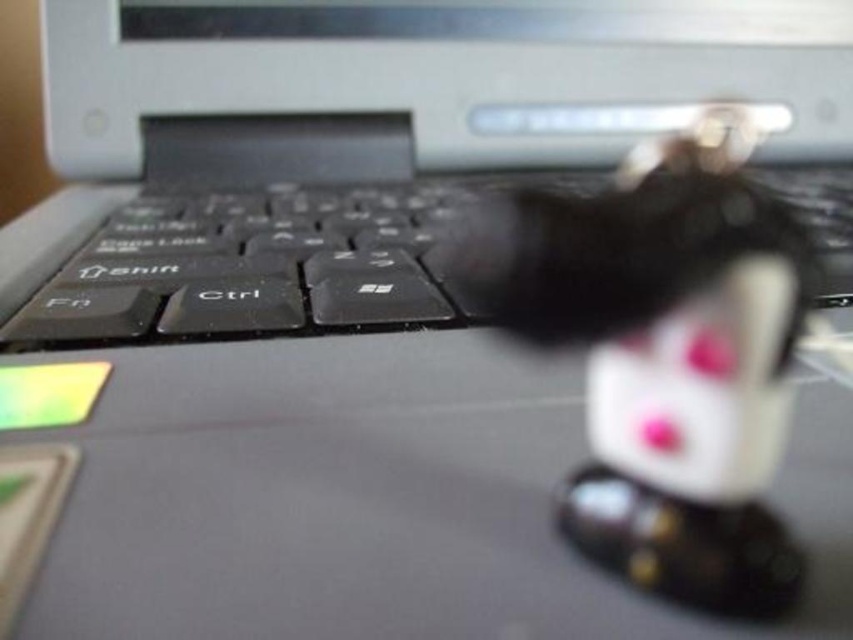
Question: Can you confirm if white glossy rabbit at center is positioned below black matte keyboard at center?

Choices:
 (A) no
 (B) yes

Answer: (B)

Question: Is white glossy rabbit at center further to the viewer compared to black matte keyboard at center?

Choices:
 (A) no
 (B) yes

Answer: (A)

Question: Which object appears closest to the camera in this image?

Choices:
 (A) white glossy rabbit at center
 (B) black matte keyboard at center

Answer: (A)

Question: Is white glossy rabbit at center smaller than black matte keyboard at center?

Choices:
 (A) no
 (B) yes

Answer: (B)

Question: Which point appears farthest from the camera in this image?

Choices:
 (A) (657, 524)
 (B) (115, 237)

Answer: (B)